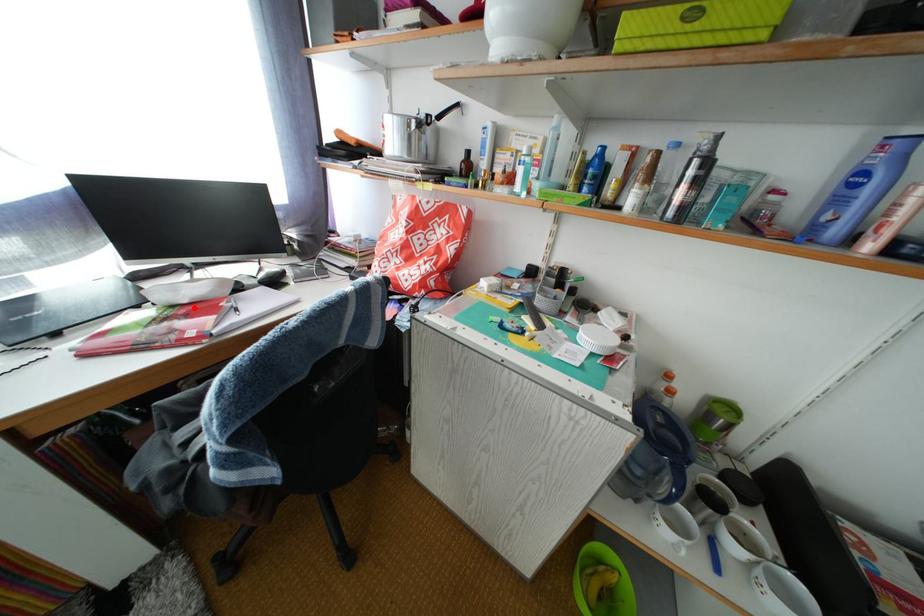
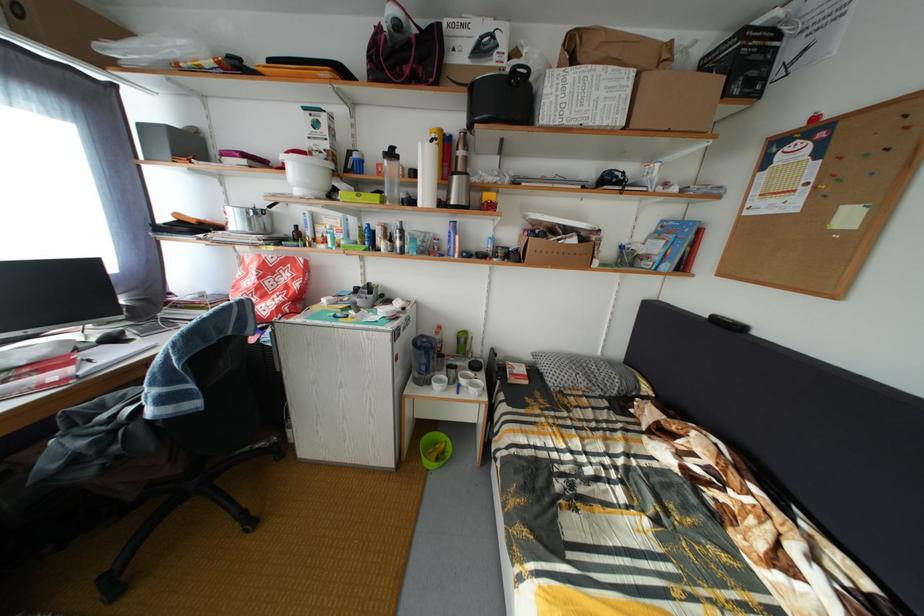
Locate, in the second image, the point that corresponds to the highlighted location in the first image.

(31, 370)